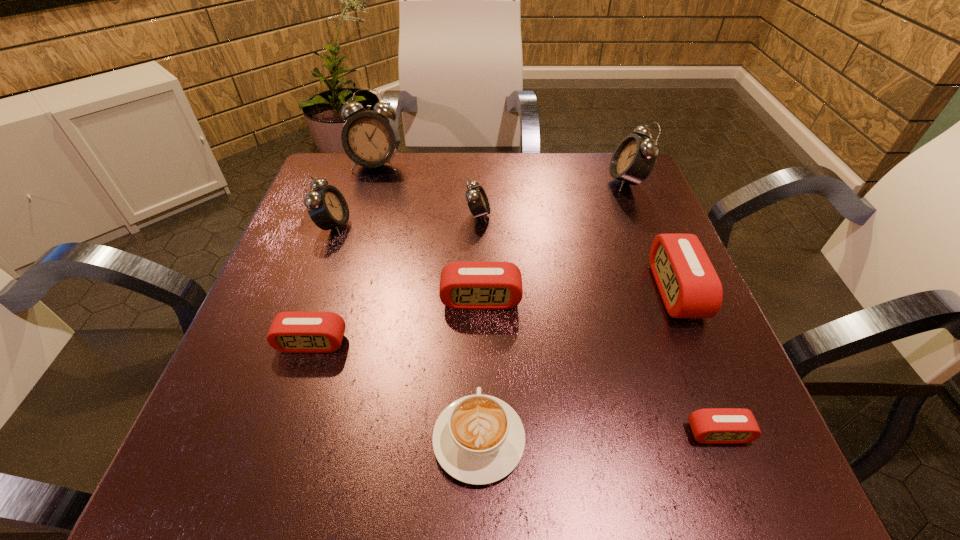
This screenshot has height=540, width=960. In order to click on alarm clock positioned at the near edge in this screenshot , I will do `click(713, 425)`.

In order to click on object present at the far left corner in this screenshot , I will do `click(370, 139)`.

Identify the location of object at the far right corner. Image resolution: width=960 pixels, height=540 pixels. (634, 158).

Locate an element on the screen. object that is at the near right corner is located at coordinates (713, 425).

At what (x,y) coordinates should I click in order to perform the action: click on free space at the far edge of the desktop. Please return your answer as a coordinate pair (x, y). This screenshot has width=960, height=540. Looking at the image, I should click on (446, 199).

Find the location of a particular element. Image resolution: width=960 pixels, height=540 pixels. vacant space at the near edge of the desktop is located at coordinates (590, 464).

Find the location of a particular element. free region at the left edge of the desktop is located at coordinates (345, 253).

The image size is (960, 540). In order to click on vacant space at the right edge of the desktop in this screenshot , I will do `click(665, 330)`.

Identify the location of vacant region at the far left corner of the desktop. The image size is (960, 540). (352, 197).

In the image, there is a desktop. Where is `free space at the far right corner`? This screenshot has height=540, width=960. free space at the far right corner is located at coordinates (608, 179).